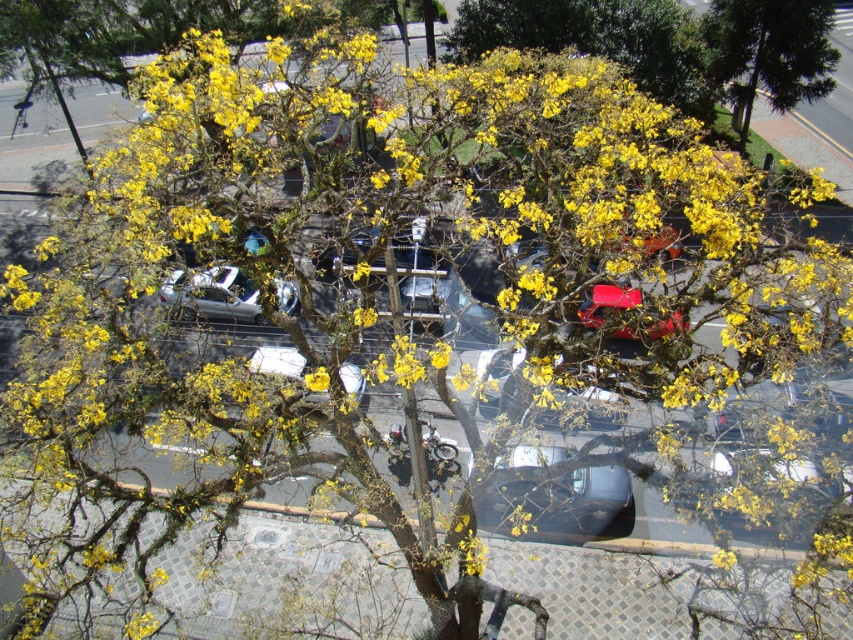
Looking at this image, can you confirm if green textured pine tree at upper right is wider than metallic silver car at center?

Yes, green textured pine tree at upper right is wider than metallic silver car at center.

From the picture: Measure the distance between point (769,67) and camera.

Point (769,67) is 32.70 meters from camera.

In order to click on green textured pine tree at upper right in this screenshot , I will do `click(772, 51)`.

Between point (613, 509) and point (677, 332), which one is positioned in front?

Point (677, 332) is more forward.

Which is behind, point (561, 504) or point (616, 337)?

The point (616, 337) is more distant.

Which is behind, point (511, 508) or point (664, 332)?

Positioned behind is point (511, 508).

You are a GUI agent. You are given a task and a screenshot of the screen. Output one action in this format:
    pyautogui.click(x=<x>, y=<y>)
    Task: Click on the metallic silver car at center
    Image resolution: width=853 pixels, height=640 pixels.
    Given the screenshot: What is the action you would take?
    pyautogui.click(x=552, y=493)

Between satin silver car at center and shiny red car at center, which one is positioned lower?

Positioned lower is shiny red car at center.

Which is in front, point (280, 300) or point (624, 288)?

Positioned in front is point (624, 288).

The height and width of the screenshot is (640, 853). Find the location of `satin silver car at center`. satin silver car at center is located at coordinates (213, 292).

Find the location of a particular element. The width and height of the screenshot is (853, 640). satin silver car at center is located at coordinates coord(213,292).